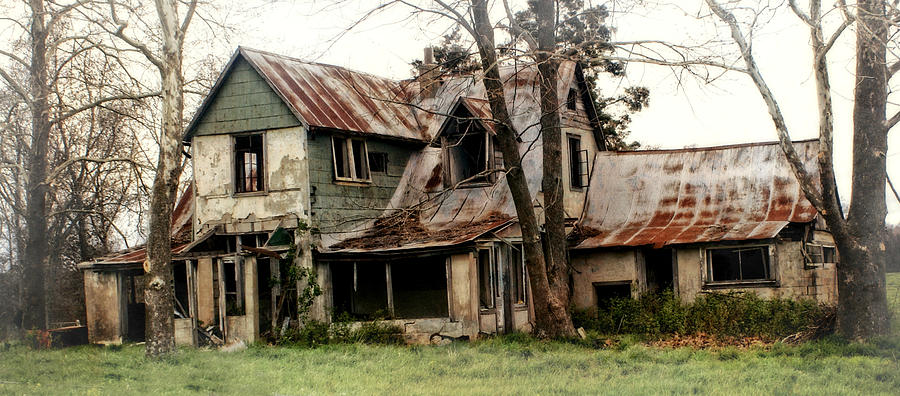
This screenshot has width=900, height=396. Identify the location of door. (657, 286), (274, 318).